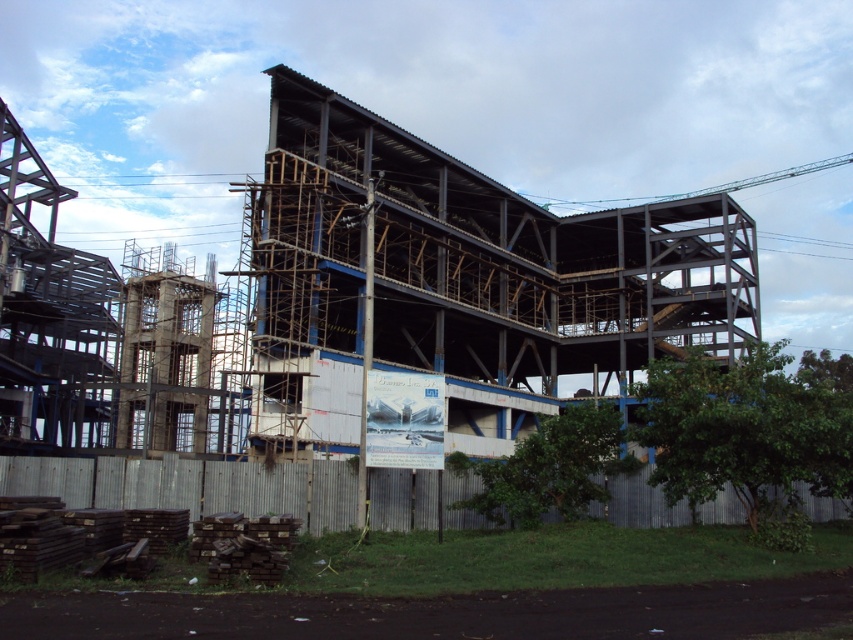
You are a construction worker who needs to transport materials from the gray corrugated metal fence at lower center to the metal scaffolding at center. The materials are in a cart that can carry up to 50 meters of distance. Can you safely make the trip without exceeding the cart capacity?

The metal scaffolding at center is 32.51 meters from the gray corrugated metal fence at lower center, so yes, the distance is within the cart capacity of 50 meters. The trip can be made safely.

You are standing at the center of the construction site and see the point marked at coordinates (x=463, y=280). What object is located at that point?

The point at coordinates (x=463, y=280) corresponds to metal scaffolding at center.

What are the coordinates of the metal scaffolding at center?

The coordinates of the metal scaffolding at center are at point (463, 280).